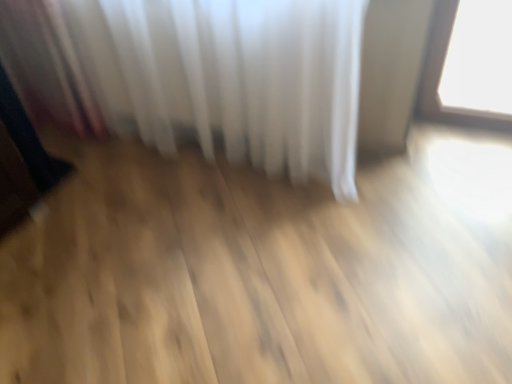
Question: Considering the relative sizes of metallic reflective object at left and white sheer curtain at upper center in the image provided, is metallic reflective object at left thinner than white sheer curtain at upper center?

Choices:
 (A) no
 (B) yes

Answer: (B)

Question: Considering the relative sizes of metallic reflective object at left and white sheer curtain at upper center in the image provided, is metallic reflective object at left smaller than white sheer curtain at upper center?

Choices:
 (A) no
 (B) yes

Answer: (B)

Question: Considering the relative positions of metallic reflective object at left and white sheer curtain at upper center in the image provided, is metallic reflective object at left in front of white sheer curtain at upper center?

Choices:
 (A) yes
 (B) no

Answer: (B)

Question: From a real-world perspective, is metallic reflective object at left below white sheer curtain at upper center?

Choices:
 (A) no
 (B) yes

Answer: (B)

Question: Considering the relative positions of metallic reflective object at left and white sheer curtain at upper center in the image provided, is metallic reflective object at left to the right of white sheer curtain at upper center from the viewer's perspective?

Choices:
 (A) no
 (B) yes

Answer: (A)

Question: Is white sheer curtain at upper center at the back of metallic reflective object at left?

Choices:
 (A) no
 (B) yes

Answer: (A)

Question: From the image's perspective, is white sheer curtain at upper center over metallic reflective object at left?

Choices:
 (A) no
 (B) yes

Answer: (B)

Question: Does white sheer curtain at upper center lie in front of metallic reflective object at left?

Choices:
 (A) no
 (B) yes

Answer: (B)

Question: Can you confirm if white sheer curtain at upper center is positioned to the right of metallic reflective object at left?

Choices:
 (A) no
 (B) yes

Answer: (B)

Question: From the image's perspective, is white sheer curtain at upper center beneath metallic reflective object at left?

Choices:
 (A) no
 (B) yes

Answer: (A)

Question: Considering the relative sizes of white sheer curtain at upper center and metallic reflective object at left in the image provided, is white sheer curtain at upper center bigger than metallic reflective object at left?

Choices:
 (A) yes
 (B) no

Answer: (A)

Question: From a real-world perspective, is white sheer curtain at upper center over metallic reflective object at left?

Choices:
 (A) yes
 (B) no

Answer: (A)

Question: Considering the relative positions of metallic reflective object at left and white sheer curtain at upper center in the image provided, is metallic reflective object at left to the left or to the right of white sheer curtain at upper center?

Choices:
 (A) left
 (B) right

Answer: (A)